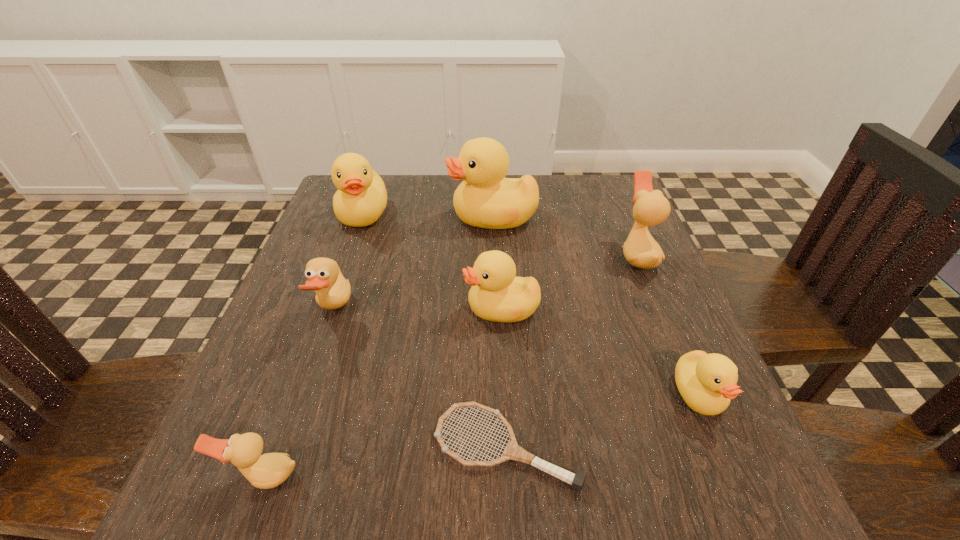
Identify the location of vacant space situated 0.230m at the beak of the second nearest yellow duck. The image size is (960, 540). (345, 309).

This screenshot has height=540, width=960. I want to click on vacant space located 0.200m at the beak of the second nearest yellow duck, so click(x=360, y=309).

This screenshot has width=960, height=540. Find the location of `free space located 0.210m at the beak of the second nearest yellow duck`. free space located 0.210m at the beak of the second nearest yellow duck is located at coordinates (355, 309).

At what (x,y) coordinates should I click in order to perform the action: click on free space located 0.330m on the beak of the second biggest tan duck. Please return your answer as a coordinate pair (x, y). This screenshot has width=960, height=540. Looking at the image, I should click on (521, 310).

Find the location of `vacant space located on the left of the gray tennis racket`. vacant space located on the left of the gray tennis racket is located at coordinates (255, 448).

Image resolution: width=960 pixels, height=540 pixels. In order to click on duck positioned at the near edge in this screenshot , I will do `click(269, 470)`.

What are the coordinates of `tennis racket located at the near edge` in the screenshot? It's located at (513, 451).

Locate an element on the screen. object that is at the far left corner is located at coordinates (361, 198).

The image size is (960, 540). I want to click on object at the near left corner, so (269, 470).

In the image, there is a desktop. Find the location of `vacant space at the far edge`. vacant space at the far edge is located at coordinates (411, 217).